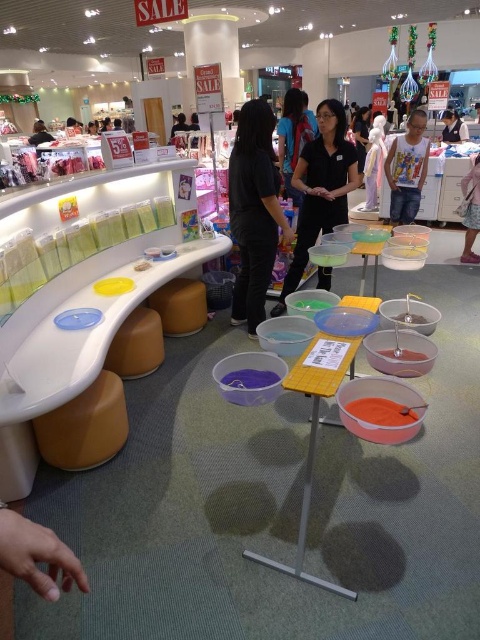
Does black matte shirt at center have a smaller size compared to white cotton t-shirt at center?

No, black matte shirt at center is not smaller than white cotton t-shirt at center.

Can you confirm if black matte shirt at center is wider than white cotton t-shirt at center?

Correct, the width of black matte shirt at center exceeds that of white cotton t-shirt at center.

Where is `black matte shirt at center`? Image resolution: width=480 pixels, height=640 pixels. black matte shirt at center is located at coordinates click(321, 188).

What do you see at coordinates (84, 426) in the screenshot? The width and height of the screenshot is (480, 640). I see `matte orange stool at lower left` at bounding box center [84, 426].

From the picture: Between matte orange stool at lower left and matte brown stool at lower left, which one has more height?

With more height is matte brown stool at lower left.

The width and height of the screenshot is (480, 640). Describe the element at coordinates (84, 426) in the screenshot. I see `matte orange stool at lower left` at that location.

Identify the location of matte orange stool at lower left. (84, 426).

Between point (131, 364) and point (444, 134), which one is positioned in front?

Positioned in front is point (131, 364).

Can you confirm if matte brown stool at lower left is taller than matte black shirt at upper right?

In fact, matte brown stool at lower left may be shorter than matte black shirt at upper right.

Find the location of a particular element. This screenshot has width=480, height=640. matte brown stool at lower left is located at coordinates (136, 344).

I want to click on matte brown stool at lower left, so click(136, 344).